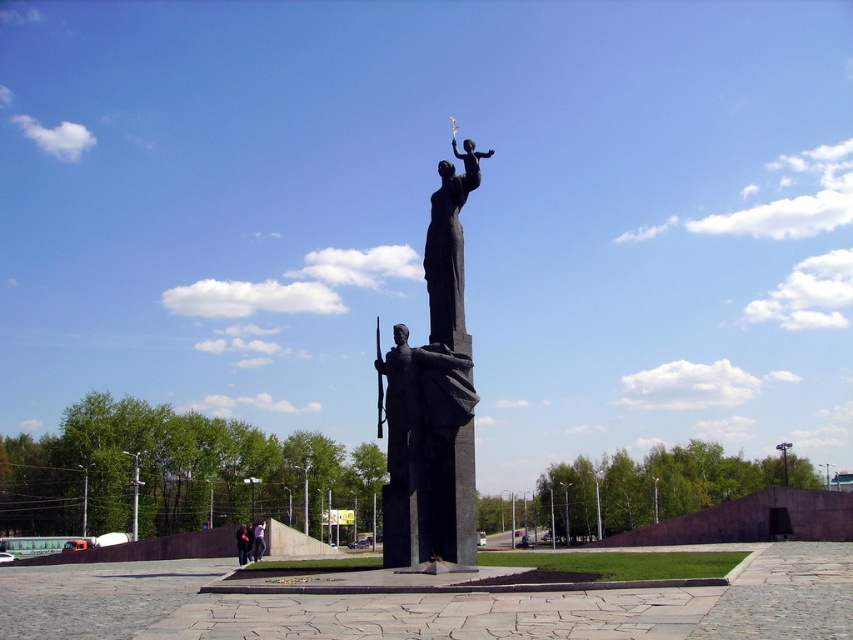
Question: Where is dark blue fabric jacket at center located in relation to light blue jeans at center in the image?

Choices:
 (A) below
 (B) above

Answer: (A)

Question: Which point is farther to the camera?

Choices:
 (A) polished bronze statue at center
 (B) dark blue fabric jacket at center

Answer: (B)

Question: Does black polished statue at center appear on the left side of light blue jeans at center?

Choices:
 (A) yes
 (B) no

Answer: (B)

Question: Which of the following is the farthest from the observer?

Choices:
 (A) (260, 529)
 (B) (392, 458)

Answer: (A)

Question: Is black polished statue at center thinner than dark blue fabric jacket at center?

Choices:
 (A) yes
 (B) no

Answer: (B)

Question: Which object is positioned closest to the dark blue fabric jacket at center?

Choices:
 (A) black polished statue at center
 (B) light blue jeans at center

Answer: (B)